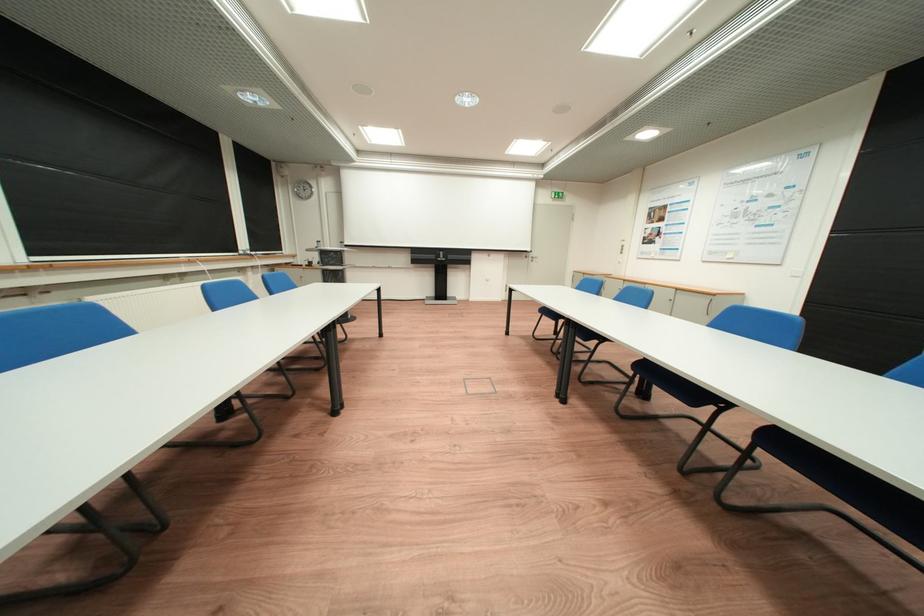
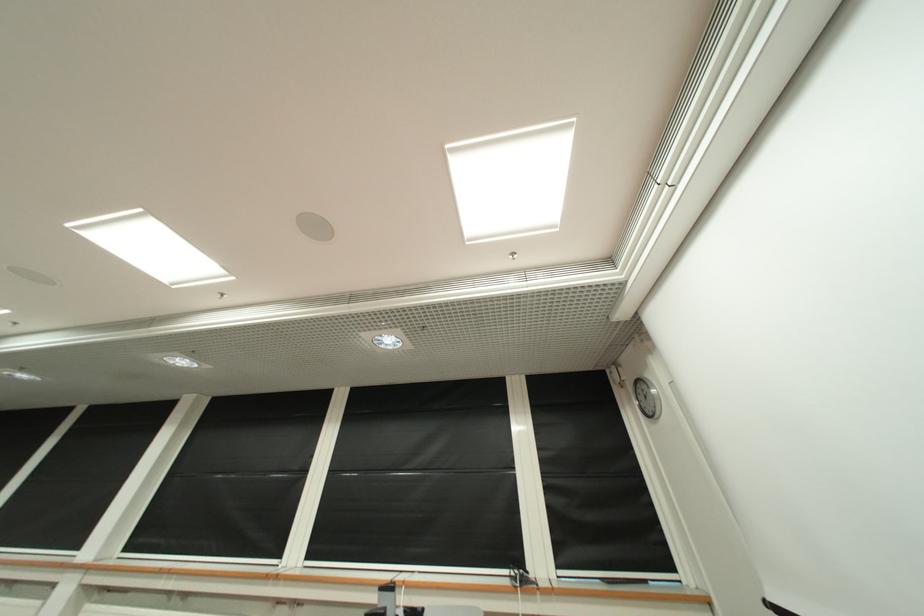
Where in the second image is the point corresponding to (x=298, y=187) from the first image?

(642, 402)